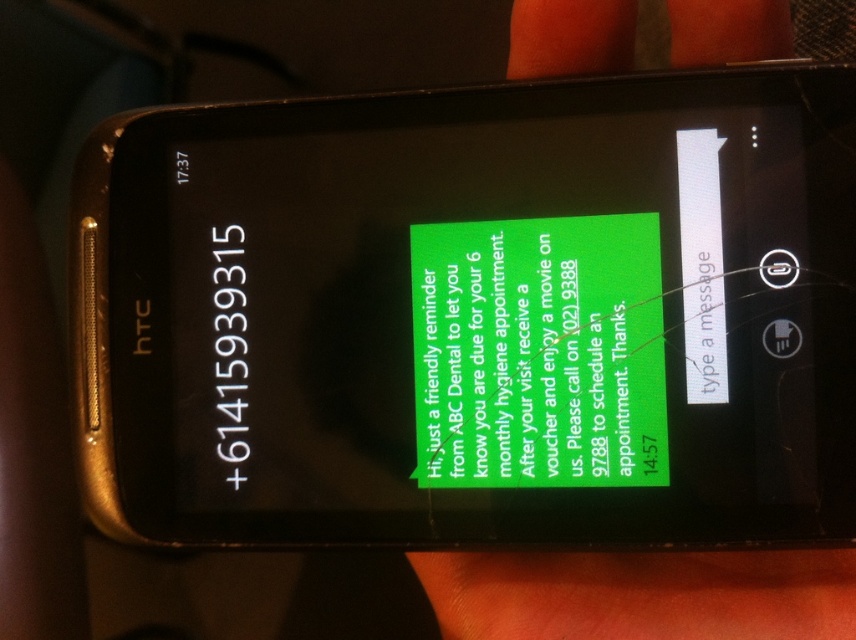
You are holding the black plastic smartphone at center and want to call the number displayed on the white glossy phone number at upper left. Can you see the phone number clearly?

The black plastic smartphone at center is in front of the white glossy phone number at upper left, so the phone number may be partially or fully obscured, making it difficult to see clearly.

You are looking at the HTC smartphone screen and see the white glossy phone number at upper left and the white matte text at upper right. Which one has a larger size?

The white glossy phone number at upper left is bigger than the white matte text at upper right.